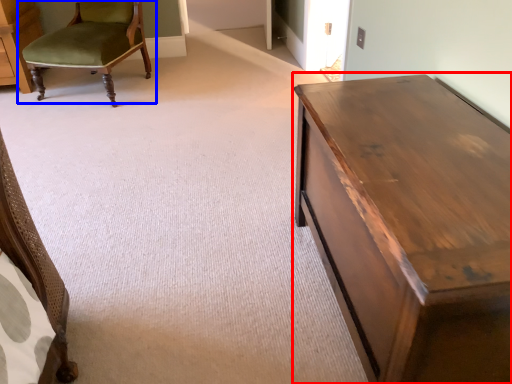
Question: Which of the following is the farthest to the observer, table (highlighted by a red box) or chair (highlighted by a blue box)?

Choices:
 (A) table
 (B) chair

Answer: (B)